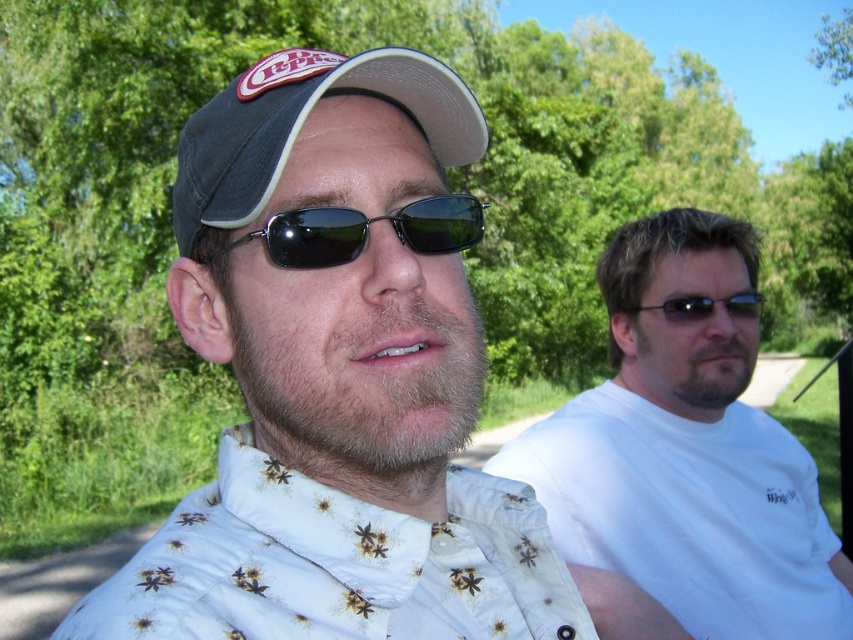
Who is lower down, white floral shirt at center or black matte sunglasses at center?

white floral shirt at center is below.

Image resolution: width=853 pixels, height=640 pixels. Describe the element at coordinates (337, 376) in the screenshot. I see `white floral shirt at center` at that location.

At what (x,y) coordinates should I click in order to perform the action: click on white floral shirt at center. Please return your answer as a coordinate pair (x, y). The height and width of the screenshot is (640, 853). Looking at the image, I should click on (337, 376).

This screenshot has width=853, height=640. What do you see at coordinates (335, 564) in the screenshot?
I see `white floral-patterned shirt at center` at bounding box center [335, 564].

Describe the element at coordinates (335, 564) in the screenshot. I see `white floral-patterned shirt at center` at that location.

Find the location of a particular element. This screenshot has width=853, height=640. white floral-patterned shirt at center is located at coordinates (335, 564).

Between white matte shirt at right and white floral-patterned shirt at center, which one is positioned lower?

white matte shirt at right is lower down.

Is point (724, 467) farther from camera compared to point (80, 616)?

Yes, it is.

You are a GUI agent. You are given a task and a screenshot of the screen. Output one action in this format:
    pyautogui.click(x=<x>, y=<y>)
    Task: Click on the white matte shirt at right
    
    Given the screenshot: What is the action you would take?
    pyautogui.click(x=688, y=451)